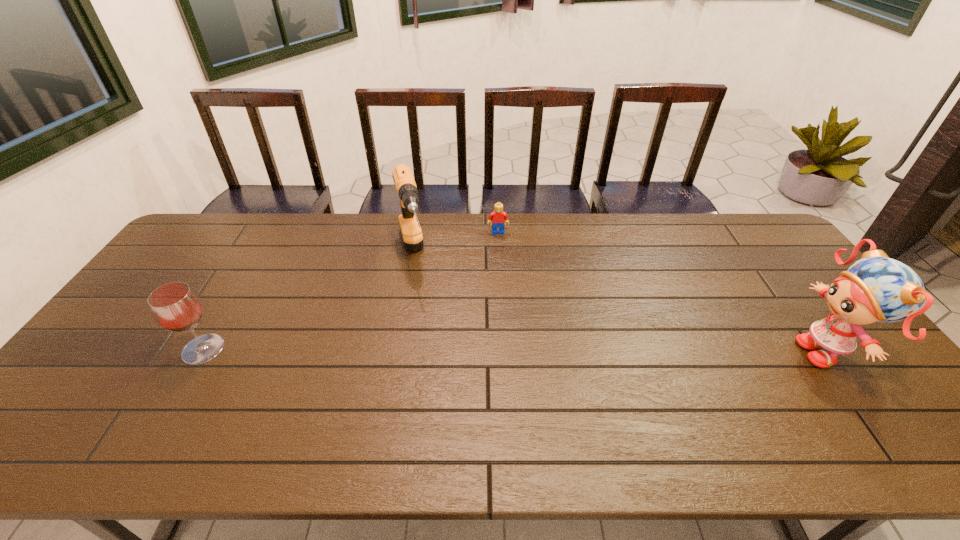
Locate an element on the screen. The width and height of the screenshot is (960, 540). free space on the desktop that is between the third tallest object and the rightmost object and is positioned on the face of the third object from left to right is located at coordinates (504, 350).

This screenshot has width=960, height=540. Identify the location of free space on the desktop that is between the second shortest object and the doll and is positioned at the tip of the third object from right to left. (440, 350).